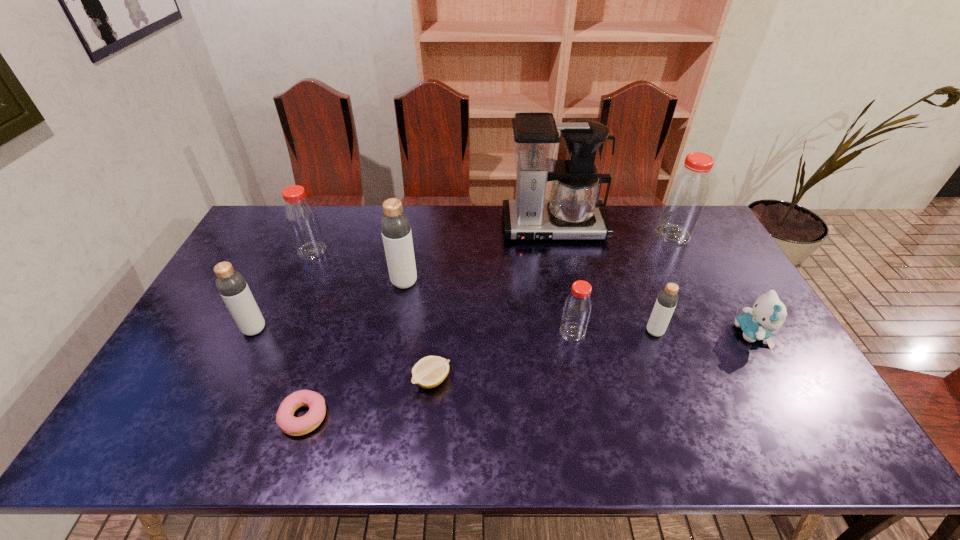
Where is `free region located 0.230m on the front of the fourth bottle from right to left`? free region located 0.230m on the front of the fourth bottle from right to left is located at coordinates (392, 352).

You are a GUI agent. You are given a task and a screenshot of the screen. Output one action in this format:
    pyautogui.click(x=<x>, y=<y>)
    Task: Click on the vacant region located on the right of the leftmost red bottle
    The width and height of the screenshot is (960, 540).
    Given the screenshot: What is the action you would take?
    409,251

Where is `free space located 0.250m on the front of the second smallest gray bottle`? The image size is (960, 540). free space located 0.250m on the front of the second smallest gray bottle is located at coordinates (209, 421).

This screenshot has width=960, height=540. Identify the location of free space located on the front of the third bottle from right to left. (586, 401).

At what (x,y) coordinates should I click in order to perform the action: click on free space located on the front of the eighth object from left to right. Please return your answer as a coordinate pair (x, y). The width and height of the screenshot is (960, 540). Looking at the image, I should click on (683, 406).

I want to click on free region located on the face of the eighth tallest object, so click(594, 334).

This screenshot has height=540, width=960. I want to click on vacant space located 0.310m on the face of the eighth tallest object, so click(x=626, y=334).

Identify the location of free space located 0.390m on the face of the eighth tallest object. The image size is (960, 540). (598, 334).

Locate an element on the screen. The width and height of the screenshot is (960, 540). vacant space situated on the back of the lemon is located at coordinates (442, 273).

The height and width of the screenshot is (540, 960). I want to click on blank space located 0.380m on the back of the nearest object, so click(x=346, y=289).